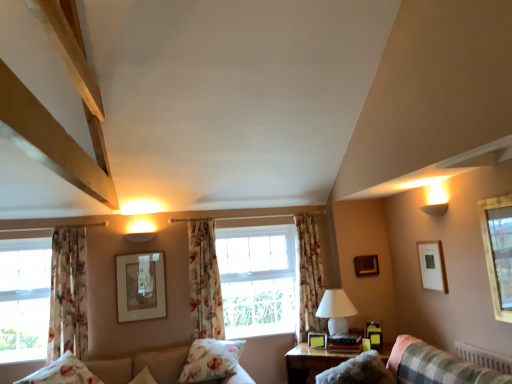
The width and height of the screenshot is (512, 384). I want to click on floral fabric curtain at center, the 2th curtain in the left-to-right sequence, so pos(204,281).

How much space does matte white picture frame at upper right, which appears as the fifth picture frame when viewed from the back, occupy horizontally?

matte white picture frame at upper right, which appears as the fifth picture frame when viewed from the back, is 1.33 inches in width.

Image resolution: width=512 pixels, height=384 pixels. What are the coordinates of `matte gold picture frame at lower center, the third picture frame in the back-to-front sequence` in the screenshot? It's located at (317, 340).

Identify the location of floral fabric pillow at center, the 1th pillow from the right. (211, 360).

Which is more to the left, floral fabric pillow at center, the 2th pillow viewed from the left, or matte white picture frame at upper right, which ranks as the fifth picture frame in left-to-right order?

floral fabric pillow at center, the 2th pillow viewed from the left.

From the image's perspective, is floral fabric pillow at center, the 1th pillow from the right, positioned above or below matte white picture frame at upper right, the first picture frame when ordered from front to back?

Based on their image positions, floral fabric pillow at center, the 1th pillow from the right, is located beneath matte white picture frame at upper right, the first picture frame when ordered from front to back.

Does floral fabric pillow at center, the 2th pillow viewed from the left, have a larger size compared to matte white picture frame at upper right, which is the 1th picture frame from right to left?

Indeed, floral fabric pillow at center, the 2th pillow viewed from the left, has a larger size compared to matte white picture frame at upper right, which is the 1th picture frame from right to left.

Locate an element on the screen. The height and width of the screenshot is (384, 512). the 2nd pillow located beneath the matte white picture frame at upper right, which ranks as the fifth picture frame in left-to-right order (from a real-world perspective) is located at coordinates (211, 360).

Is beige fabric couch at lower left looking in the opposite direction of floral fabric curtain at left, the 3th curtain positioned from the right?

beige fabric couch at lower left is not turned away from floral fabric curtain at left, the 3th curtain positioned from the right.

From the image's perspective, is beige fabric couch at lower left located above or below floral fabric curtain at left, the 3th curtain positioned from the right?

Based on their image positions, beige fabric couch at lower left is located beneath floral fabric curtain at left, the 3th curtain positioned from the right.

From a real-world perspective, is beige fabric couch at lower left on top of floral fabric curtain at left, the 3th curtain positioned from the right?

No, from a real-world perspective, beige fabric couch at lower left is not on top of floral fabric curtain at left, the 3th curtain positioned from the right.

Considering the sizes of objects beige fabric couch at lower left and floral fabric curtain at left, the 3th curtain positioned from the right, in the image provided, who is thinner, beige fabric couch at lower left or floral fabric curtain at left, the 3th curtain positioned from the right,?

Thinner between the two is floral fabric curtain at left, the 3th curtain positioned from the right.

Is wooden picture frame at upper right, placed as the fourth picture frame when sorted from left to right, completely or partially outside of white glossy table lamp at center-right?

Yes.

Does wooden picture frame at upper right, the 2th picture frame when ordered from right to left, have a lesser height compared to white glossy table lamp at center-right?

Yes.

Between wooden picture frame at upper right, the 2th picture frame when ordered from right to left, and white glossy table lamp at center-right, which one is positioned in front?

white glossy table lamp at center-right.

Can you confirm if wooden picture frame at upper right, the 2th picture frame when ordered from right to left, is positioned to the right of white glossy table lamp at center-right?

Indeed, wooden picture frame at upper right, the 2th picture frame when ordered from right to left, is positioned on the right side of white glossy table lamp at center-right.

Is matte gold picture frame at lower center, which is the 3th picture frame from front to back, wider or thinner than clear glass window at upper right?

matte gold picture frame at lower center, which is the 3th picture frame from front to back, is wider than clear glass window at upper right.

Can you confirm if matte gold picture frame at lower center, which is the 3th picture frame from front to back, is shorter than clear glass window at upper right?

Indeed, matte gold picture frame at lower center, which is the 3th picture frame from front to back, has a lesser height compared to clear glass window at upper right.

From a real-world perspective, is matte gold picture frame at lower center, the third picture frame in the back-to-front sequence, physically located above or below clear glass window at upper right?

From a real-world perspective, matte gold picture frame at lower center, the third picture frame in the back-to-front sequence, is physically below clear glass window at upper right.

Considering the positions of points (326, 335) and (495, 218), is point (326, 335) farther from camera compared to point (495, 218)?

That is True.

Is floral fabric curtain at center, the 1th curtain from the right, bigger than matte white picture frame at upper right, which appears as the fifth picture frame when viewed from the back?

Yes.

Is floral fabric curtain at center, which is the third curtain from left to right, inside the boundaries of matte white picture frame at upper right, which ranks as the fifth picture frame in left-to-right order, or outside?

floral fabric curtain at center, which is the third curtain from left to right, is spatially situated outside matte white picture frame at upper right, which ranks as the fifth picture frame in left-to-right order.

From the image's perspective, which is above, floral fabric curtain at center, which is the third curtain from left to right, or matte white picture frame at upper right, which ranks as the fifth picture frame in left-to-right order?

matte white picture frame at upper right, which ranks as the fifth picture frame in left-to-right order.

In the scene shown: Which of these two, floral fabric curtain at center, which is the third curtain from left to right, or matte white picture frame at upper right, which appears as the fifth picture frame when viewed from the back, is thinner?

matte white picture frame at upper right, which appears as the fifth picture frame when viewed from the back.

From the picture: Is fluffy plaid couch at lower right positioned before matte gold picture frame at lower center, which is the 3th picture frame from front to back?

Yes, fluffy plaid couch at lower right is closer to the viewer.

Is there a large distance between fluffy plaid couch at lower right and matte gold picture frame at lower center, which is the 3th picture frame from front to back?

Absolutely, fluffy plaid couch at lower right is distant from matte gold picture frame at lower center, which is the 3th picture frame from front to back.

Is fluffy plaid couch at lower right turned away from matte gold picture frame at lower center, marked as the fourth picture frame in a right-to-left arrangement?

fluffy plaid couch at lower right does not have its back to matte gold picture frame at lower center, marked as the fourth picture frame in a right-to-left arrangement.

Is fluffy plaid couch at lower right wider than matte gold picture frame at lower center, which is the 3th picture frame from front to back?

Correct, the width of fluffy plaid couch at lower right exceeds that of matte gold picture frame at lower center, which is the 3th picture frame from front to back.

From the image's perspective, is white glossy table lamp at center-right above or below wooden picture frame at upper right, the 2th picture frame when ordered from right to left?

Based on their image positions, white glossy table lamp at center-right is located beneath wooden picture frame at upper right, the 2th picture frame when ordered from right to left.

Is white glossy table lamp at center-right next to wooden picture frame at upper right, placed as the fourth picture frame when sorted from left to right?

There is a gap between white glossy table lamp at center-right and wooden picture frame at upper right, placed as the fourth picture frame when sorted from left to right.

In the scene shown: Is white glossy table lamp at center-right to the left of wooden picture frame at upper right, positioned as the fifth picture frame in front-to-back order, from the viewer's perspective?

Indeed, white glossy table lamp at center-right is positioned on the left side of wooden picture frame at upper right, positioned as the fifth picture frame in front-to-back order.

From a real-world perspective, starting from the floral fabric pillow at center, the 1th pillow from the right, which picture frame is the 3rd one vertically above it? Please provide its 2D coordinates.

[(432, 265)]

The width and height of the screenshot is (512, 384). I want to click on the 1st curtain behind the beige fabric couch at lower left, counting from the anchor's position, so click(x=68, y=293).

Estimate the real-world distances between objects in this image. Which object is closer to matte white picture frame at upper right, which ranks as the fifth picture frame in left-to-right order, clear glass window at upper right or white glossy table lamp at center-right?

clear glass window at upper right.

From the image, which object appears to be farther from floral fabric curtain at center, which is the third curtain from left to right, matte gold picture frame at lower center, the second picture frame viewed from the left, or wooden picture frame at lower right, arranged as the third picture frame when viewed from the right?

Based on the image, wooden picture frame at lower right, arranged as the third picture frame when viewed from the right, appears to be further to floral fabric curtain at center, which is the third curtain from left to right.

Which object lies nearer to the anchor point wooden picture frame at lower right, the 4th picture frame in the back-to-front sequence, floral fabric pillow at center, the 2th pillow viewed from the left, or matte gold picture frame at center, which is counted as the 2th picture frame, starting from the back?

floral fabric pillow at center, the 2th pillow viewed from the left.

Considering their positions, is floral fabric curtain at left, the 3th curtain positioned from the right, positioned closer to fluffy plaid couch at lower right than wooden table at lower center?

wooden table at lower center.

Based on their spatial positions, is matte gold picture frame at center, which is the fifth picture frame in right-to-left order, or matte gold picture frame at lower center, which is the 3th picture frame from front to back, closer to fluffy plaid couch at lower right?

matte gold picture frame at lower center, which is the 3th picture frame from front to back, is positioned closer to the anchor fluffy plaid couch at lower right.

Considering their positions, is floral fabric pillow at center, the 1th pillow from the right, positioned further to clear glass window at upper right than matte gold picture frame at lower center, marked as the fourth picture frame in a right-to-left arrangement?

floral fabric pillow at center, the 1th pillow from the right, is positioned further to the anchor clear glass window at upper right.

Estimate the real-world distances between objects in this image. Which object is closer to fluffy plaid couch at lower right, white glossy table lamp at center-right or matte gold picture frame at lower center, the third picture frame in the back-to-front sequence?

Among the two, white glossy table lamp at center-right is located nearer to fluffy plaid couch at lower right.

Considering their positions, is beige fabric couch at lower left positioned further to floral fabric pillow at center, the 1th pillow from the right, than white glossy table lamp at center-right?

The object further to floral fabric pillow at center, the 1th pillow from the right, is white glossy table lamp at center-right.

Where is `table lamp between floral fabric curtain at center, the 1th curtain from the right, and matte gold picture frame at lower center, marked as the fourth picture frame in a right-to-left arrangement, in the up-down direction`? Image resolution: width=512 pixels, height=384 pixels. table lamp between floral fabric curtain at center, the 1th curtain from the right, and matte gold picture frame at lower center, marked as the fourth picture frame in a right-to-left arrangement, in the up-down direction is located at coordinates (336, 310).

At what (x,y) coordinates should I click in order to perform the action: click on studio couch between matte gold picture frame at center, which is the fifth picture frame in right-to-left order, and white glossy table lamp at center-right. Please return your answer as a coordinate pair (x, y). Looking at the image, I should click on (142, 366).

Identify the location of picture frame between floral fabric pillow at center, the 1th pillow from the right, and white glossy table lamp at center-right. (317, 340).

Locate an element on the screen. curtain between matte gold picture frame at center, the first picture frame viewed from the left, and floral fabric pillow at center, the 1th pillow from the right, from left to right is located at coordinates (204, 281).